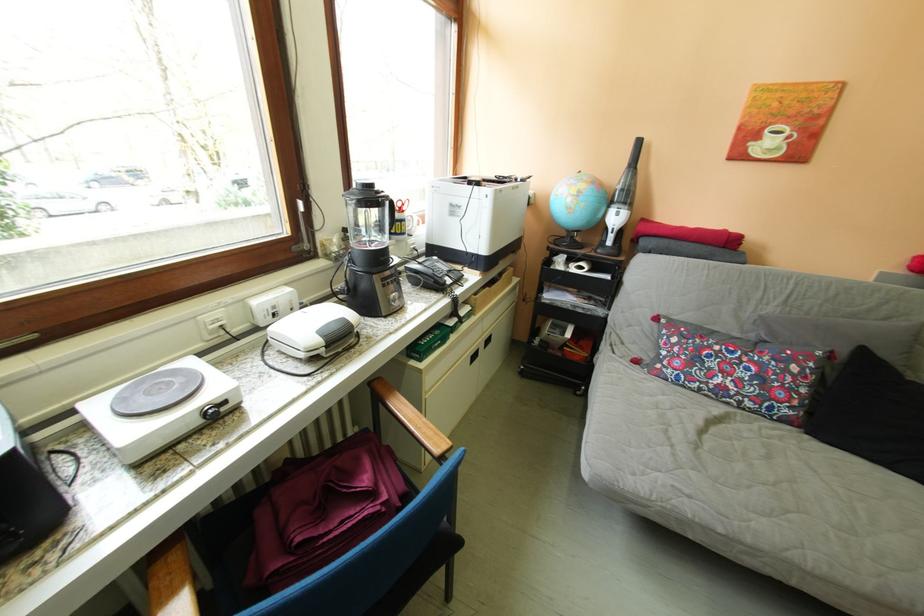
This screenshot has height=616, width=924. What are the coordinates of `blender control knob` in the screenshot? It's located at (392, 301).